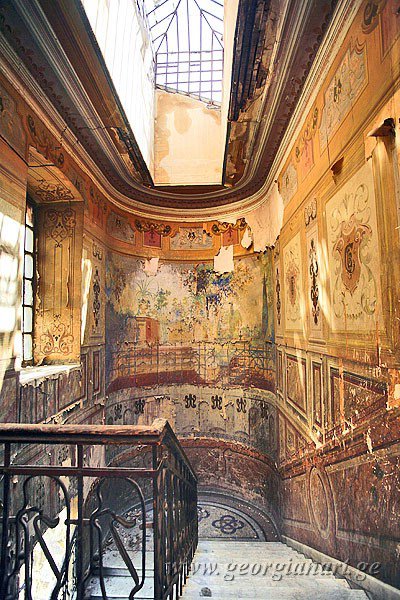
Locate an element on the screen. This screenshot has height=600, width=400. window is located at coordinates (x=26, y=291), (x=181, y=24).